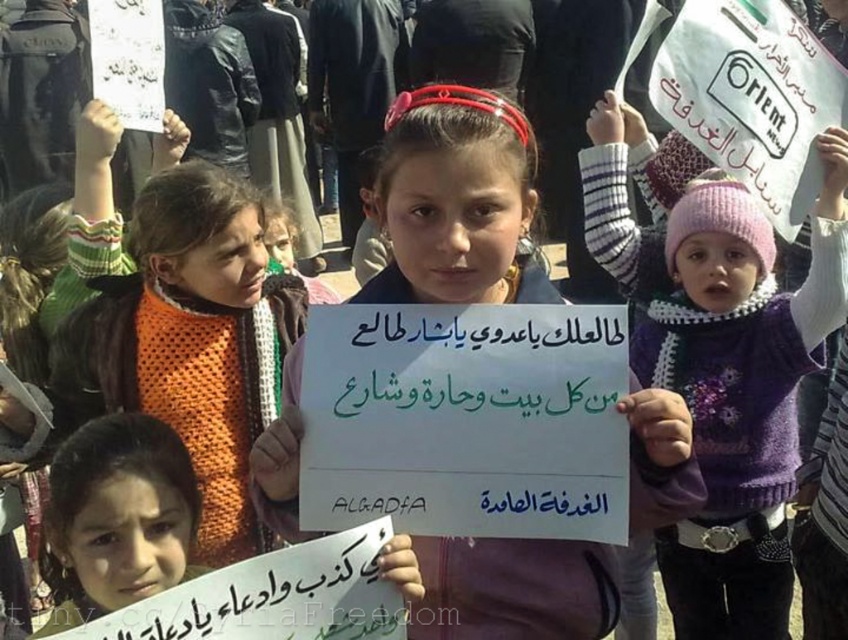
In the scene shown: Between purple knitted sweater at center and orange knitted sweater at upper left, which one is positioned lower?

purple knitted sweater at center is below.

Image resolution: width=848 pixels, height=640 pixels. Identify the location of purple knitted sweater at center. (721, 358).

This screenshot has height=640, width=848. What do you see at coordinates (721, 358) in the screenshot?
I see `purple knitted sweater at center` at bounding box center [721, 358].

Where is `purple knitted sweater at center`? This screenshot has height=640, width=848. purple knitted sweater at center is located at coordinates (721, 358).

Can you confirm if purple knitted sweater at center is smaller than white paper sign at center?

No.

Does point (743, 204) come closer to viewer compared to point (659, 509)?

No, (743, 204) is behind (659, 509).

Where is `purple knitted sweater at center`? purple knitted sweater at center is located at coordinates (721, 358).

From the picture: Who is positioned more to the right, white paper sign at center or orange knitted sweater at upper left?

white paper sign at center

Which is below, white paper sign at center or orange knitted sweater at upper left?

orange knitted sweater at upper left

Does point (428, 164) come in front of point (171, 212)?

That is True.

I want to click on white paper sign at center, so click(456, 202).